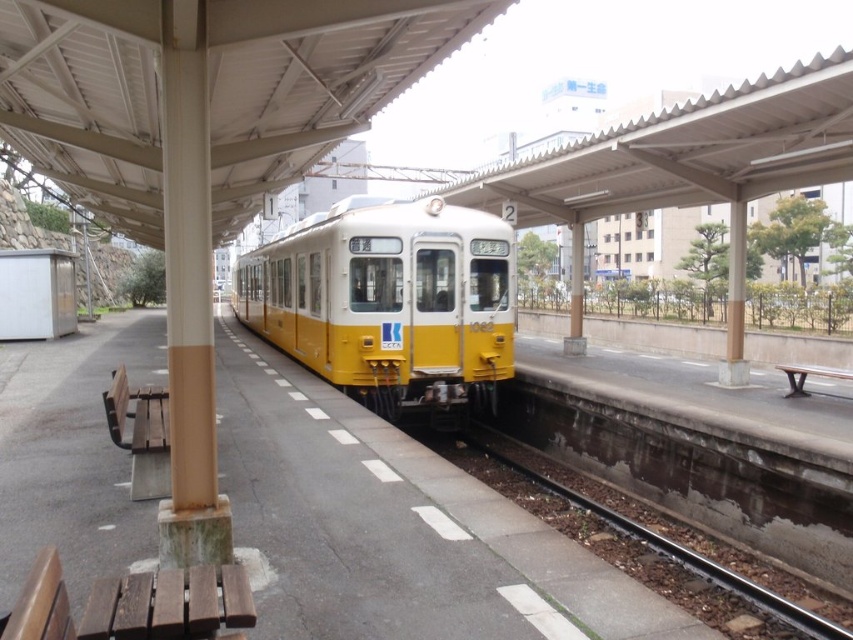
Question: Does yellow matte train at center appear on the right side of brown gravel at lower center?

Choices:
 (A) no
 (B) yes

Answer: (A)

Question: Is yellow matte train at center below brown gravel at lower center?

Choices:
 (A) yes
 (B) no

Answer: (B)

Question: Is yellow matte train at center closer to camera compared to brown gravel at lower center?

Choices:
 (A) no
 (B) yes

Answer: (A)

Question: Which object is farther from the camera taking this photo?

Choices:
 (A) brown gravel at lower center
 (B) yellow matte train at center

Answer: (B)

Question: Which of the following is the farthest from the observer?

Choices:
 (A) (538, 456)
 (B) (403, 275)

Answer: (A)